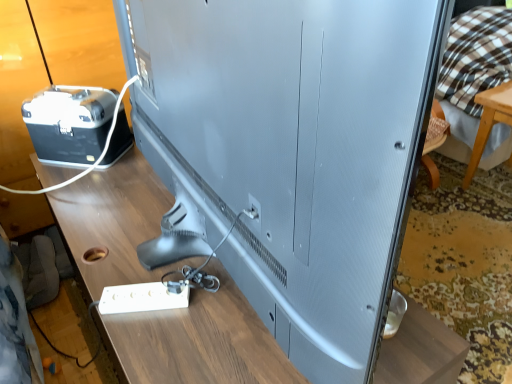
At what (x,y) coordinates should I click in order to perform the action: click on vacant area on top of wooden table at center (from a real-world perspective). Please return your answer as a coordinate pair (x, y). Looking at the image, I should click on (150, 236).